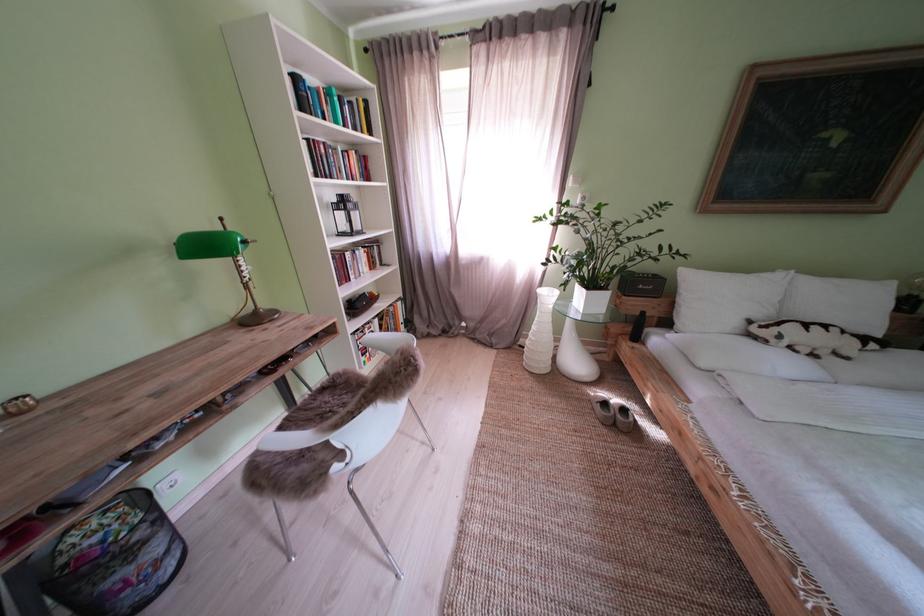
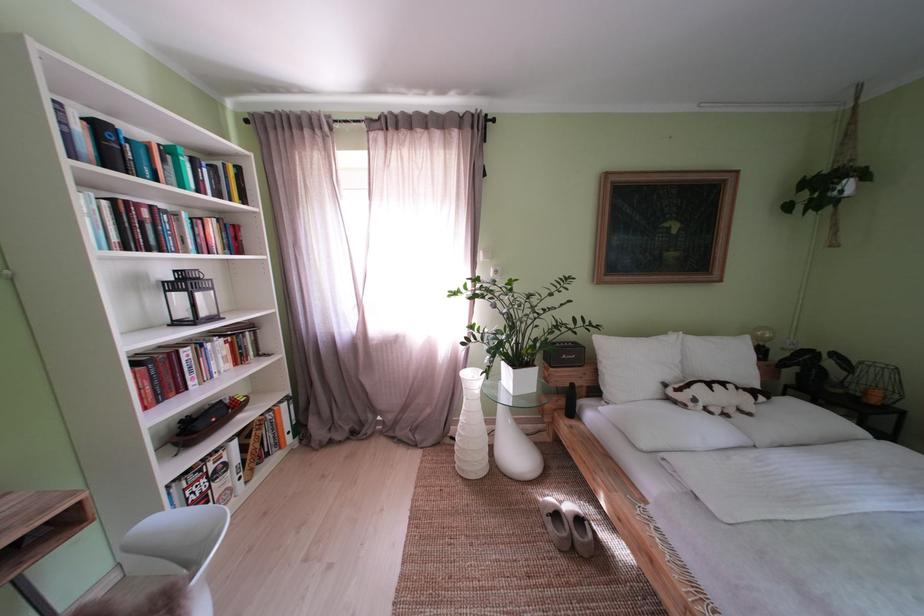
Where in the second image is the point corresponding to (847,286) from the first image?

(723, 344)